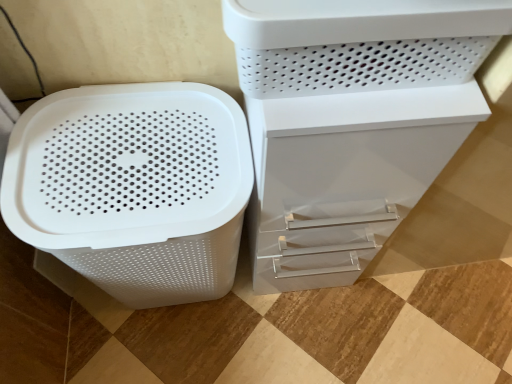
Describe the element at coordinates (360, 43) in the screenshot. I see `white plastic container at upper right` at that location.

Identify the location of white plastic file cabinet at center. (345, 176).

Measure the distance between point (366, 170) and camera.

Point (366, 170) is 26.42 inches away from camera.

Where is `white plastic container at upper right`? The image size is (512, 384). white plastic container at upper right is located at coordinates (360, 43).

Is white matte plastic basket at left spatially inside white plastic file cabinet at center, or outside of it?

white matte plastic basket at left cannot be found inside white plastic file cabinet at center.

Looking at this image, is white matte plastic basket at left wider or thinner than white plastic file cabinet at center?

Considering their sizes, white matte plastic basket at left looks broader than white plastic file cabinet at center.

From the picture: From a real-world perspective, is white matte plastic basket at left physically below white plastic file cabinet at center?

Yes, from a real-world perspective, white matte plastic basket at left is under white plastic file cabinet at center.

How distant is white matte plastic basket at left from white plastic file cabinet at center?

white matte plastic basket at left and white plastic file cabinet at center are 8.94 inches apart.

Which is correct: white plastic file cabinet at center is inside white matte plastic basket at left, or outside of it?

white plastic file cabinet at center is not enclosed by white matte plastic basket at left.

Find the location of `waste container on the left of white plastic file cabinet at center`. waste container on the left of white plastic file cabinet at center is located at coordinates (133, 187).

Is white plastic file cabinet at center far from white matte plastic basket at left?

No.

Is white plastic file cabinet at center facing towards white matte plastic basket at left?

No.

Do you think white plastic container at upper right is within white plastic file cabinet at center, or outside of it?

white plastic container at upper right lies outside white plastic file cabinet at center.

From a real-world perspective, between white plastic container at upper right and white plastic file cabinet at center, who is vertically higher?

From a 3D spatial view, white plastic container at upper right is above.

Does point (436, 60) come behind point (259, 269)?

No, (436, 60) is closer to viewer.

Could you tell me if white plastic container at upper right is turned towards white plastic file cabinet at center?

No, white plastic container at upper right is not oriented towards white plastic file cabinet at center.

Does white plastic file cabinet at center have a greater width compared to white plastic container at upper right?

Yes, white plastic file cabinet at center is wider than white plastic container at upper right.

You are a GUI agent. You are given a task and a screenshot of the screen. Output one action in this format:
    pyautogui.click(x=<x>, y=<y>)
    Task: Click on the file cabinet lying behind the white plastic container at upper right
    
    Given the screenshot: What is the action you would take?
    pyautogui.click(x=345, y=176)

From a real-world perspective, between white plastic file cabinet at center and white plastic container at upper right, who is vertically lower?

From a 3D spatial view, white plastic file cabinet at center is below.

Between white plastic file cabinet at center and white plastic container at upper right, which one has less height?

white plastic container at upper right.

From a real-world perspective, which object rests below the other?

From a 3D spatial view, white matte plastic basket at left is below.

Which is behind, white matte plastic basket at left or white plastic container at upper right?

white matte plastic basket at left.

This screenshot has width=512, height=384. I want to click on appliance above the white matte plastic basket at left (from the image's perspective), so click(360, 43).

Is white matte plastic basket at left far away from white plastic container at upper right?

They are positioned close to each other.

Do you think white plastic container at upper right is within white matte plastic basket at left, or outside of it?

white plastic container at upper right is outside white matte plastic basket at left.

Is white plastic container at upper right closer to the viewer compared to white matte plastic basket at left?

Yes, the depth of white plastic container at upper right is less than that of white matte plastic basket at left.

From a real-world perspective, is white plastic container at upper right physically above white matte plastic basket at left?

Yes.

Is white plastic container at upper right shorter than white matte plastic basket at left?

Yes.

What are the coordinates of `waste container below the white plastic file cabinet at center (from a real-world perspective)` in the screenshot? It's located at (133, 187).

Identify the location of waste container on the left of white plastic file cabinet at center. The image size is (512, 384). (133, 187).

When comparing their distances from white plastic container at upper right, does white matte plastic basket at left or white plastic file cabinet at center seem closer?

The object closer to white plastic container at upper right is white plastic file cabinet at center.

Considering their positions, is white plastic container at upper right positioned further to white plastic file cabinet at center than white matte plastic basket at left?

white matte plastic basket at left is further to white plastic file cabinet at center.

Looking at the image, which one is located further to white matte plastic basket at left, white plastic file cabinet at center or white plastic container at upper right?

white plastic container at upper right is positioned further to the anchor white matte plastic basket at left.

Considering their positions, is white plastic container at upper right positioned closer to white matte plastic basket at left than white plastic file cabinet at center?

white plastic file cabinet at center is positioned closer to the anchor white matte plastic basket at left.

Based on their spatial positions, is white matte plastic basket at left or white plastic container at upper right further from white plastic file cabinet at center?

Among the two, white matte plastic basket at left is located further to white plastic file cabinet at center.

When comparing their distances from white plastic container at upper right, does white plastic file cabinet at center or white matte plastic basket at left seem further?

Based on the image, white matte plastic basket at left appears to be further to white plastic container at upper right.

In order to click on appliance located between white matte plastic basket at left and white plastic file cabinet at center in the left-right direction in this screenshot , I will do `click(360, 43)`.